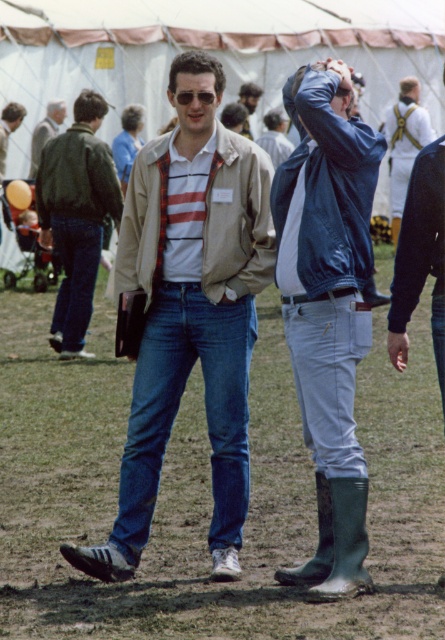
Is green rubber boot at lower right thinner than matte black jacket at center?

Indeed, green rubber boot at lower right has a lesser width compared to matte black jacket at center.

In the scene shown: Can you confirm if green rubber boot at lower right is taller than matte black jacket at center?

Incorrect, green rubber boot at lower right's height is not larger of matte black jacket at center's.

Where is `green rubber boot at lower right`? green rubber boot at lower right is located at coordinates (318, 544).

Who is more distant from viewer, (x=47, y=216) or (x=338, y=515)?

Positioned behind is point (x=47, y=216).

Can you confirm if matte green jacket at left is shorter than green rubber boot at lower center?

No, matte green jacket at left is not shorter than green rubber boot at lower center.

At what (x,y) coordinates should I click in order to perform the action: click on matte green jacket at left. Please return your answer as a coordinate pair (x, y). Looking at the image, I should click on (76, 216).

Does point (210, 385) come closer to viewer compared to point (246, 134)?

Yes, point (210, 385) is in front of point (246, 134).

Can you confirm if denim jeans at center is taller than matte black jacket at center?

Yes, denim jeans at center is taller than matte black jacket at center.

Between point (149, 369) and point (242, 102), which one is positioned behind?

The point (242, 102) is behind.

Locate an element on the screen. The height and width of the screenshot is (640, 445). denim jeans at center is located at coordinates (178, 406).